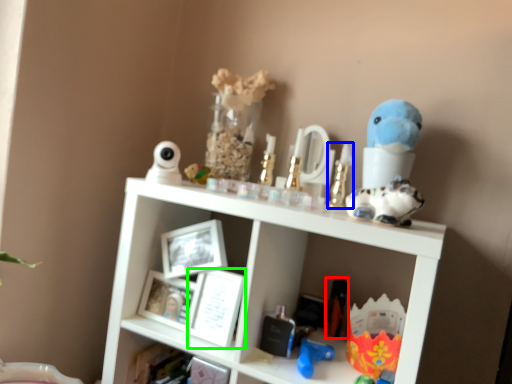
Question: Which is nearer to the toy (highlighted by a red box)? toy (highlighted by a blue box) or picture frame (highlighted by a green box).

Choices:
 (A) toy
 (B) picture frame

Answer: (A)